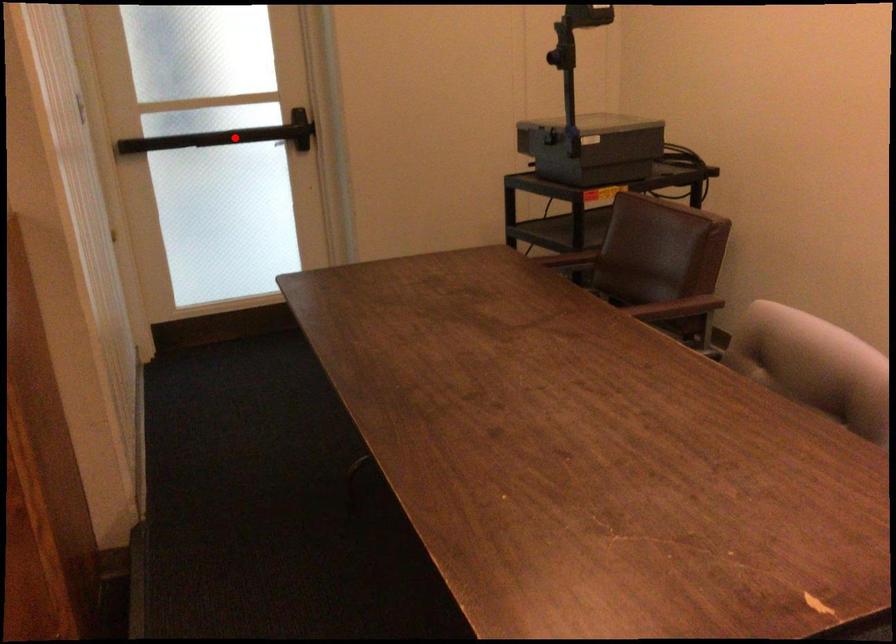
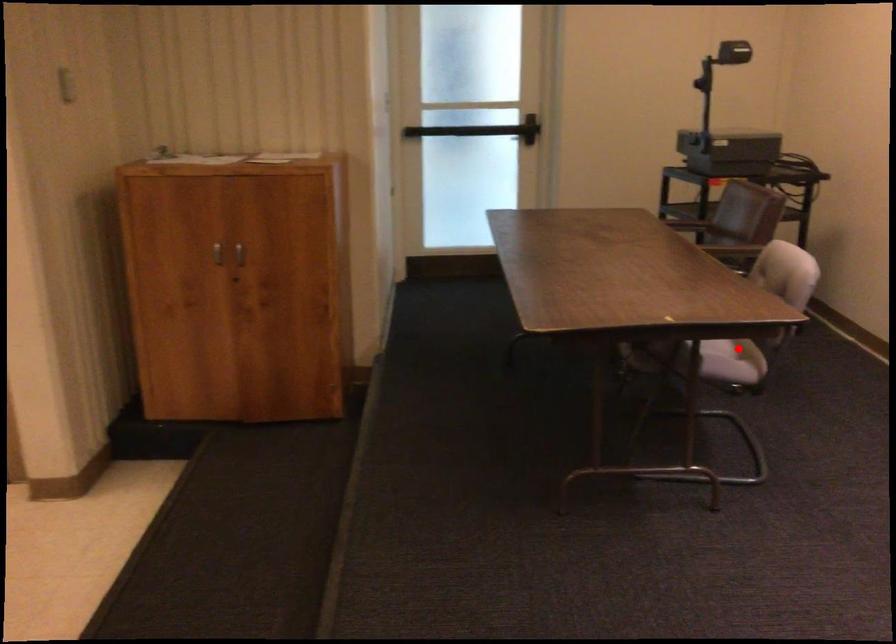
I am providing you with two images of the same scene from different viewpoints. A red point is marked on the first image and another point is marked on the second image. Do the highlighted points in image1 and image2 indicate the same real-world spot?

No